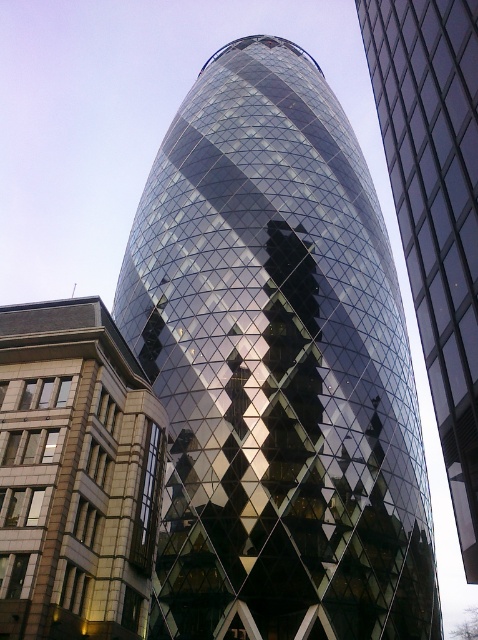
Between point (3, 448) and point (446, 256), which one is positioned in front?

Point (446, 256)

Is point (138, 419) farther from viewer compared to point (477, 301)?

Yes.

You are a GUI agent. You are given a task and a screenshot of the screen. Output one action in this format:
    pyautogui.click(x=<x>, y=<y>)
    Task: Click on the beige stone building at left
    
    Given the screenshot: What is the action you would take?
    [x=76, y=474]

Who is positioned more to the left, glossy glass tower at center or beige stone building at left?

beige stone building at left

Does glossy glass tower at center come in front of beige stone building at left?

No.

Is point (307, 188) positioned behind point (147, 604)?

Yes.

At what (x,y) coordinates should I click in order to perform the action: click on glossy glass tower at center. Please return your answer as a coordinate pair (x, y). Looking at the image, I should click on (276, 369).

Does glossy glass tower at center have a smaller size compared to reflective glass tower at center?

No, glossy glass tower at center is not smaller than reflective glass tower at center.

Between glossy glass tower at center and reflective glass tower at center, which one has less height?

Standing shorter between the two is reflective glass tower at center.

Between point (227, 60) and point (446, 227), which one is positioned behind?

The point (227, 60) is more distant.

What are the coordinates of `glossy glass tower at center` in the screenshot? It's located at (276, 369).